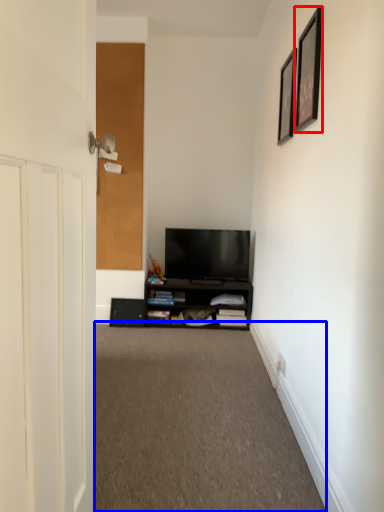
Question: Among these objects, which one is nearest to the camera, picture frame (highlighted by a red box) or plain (highlighted by a blue box)?

Choices:
 (A) picture frame
 (B) plain

Answer: (B)